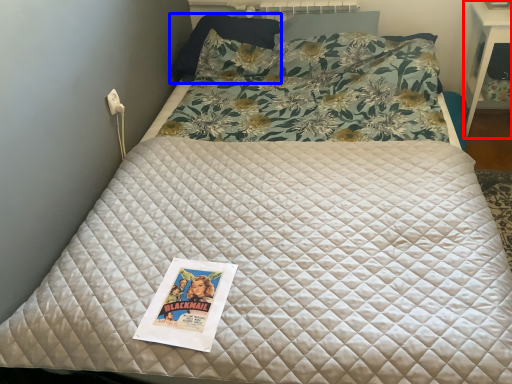
Question: Which point is further to the camera, table (highlighted by a red box) or pillow (highlighted by a blue box)?

Choices:
 (A) table
 (B) pillow

Answer: (B)